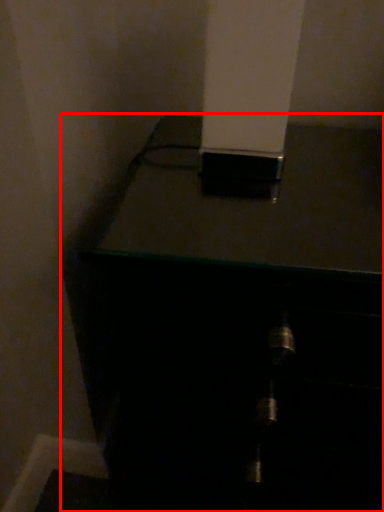
Question: Considering the relative positions of furniture (annotated by the red box) and pillar in the image provided, where is furniture (annotated by the red box) located with respect to the staircase?

Choices:
 (A) left
 (B) right

Answer: (B)